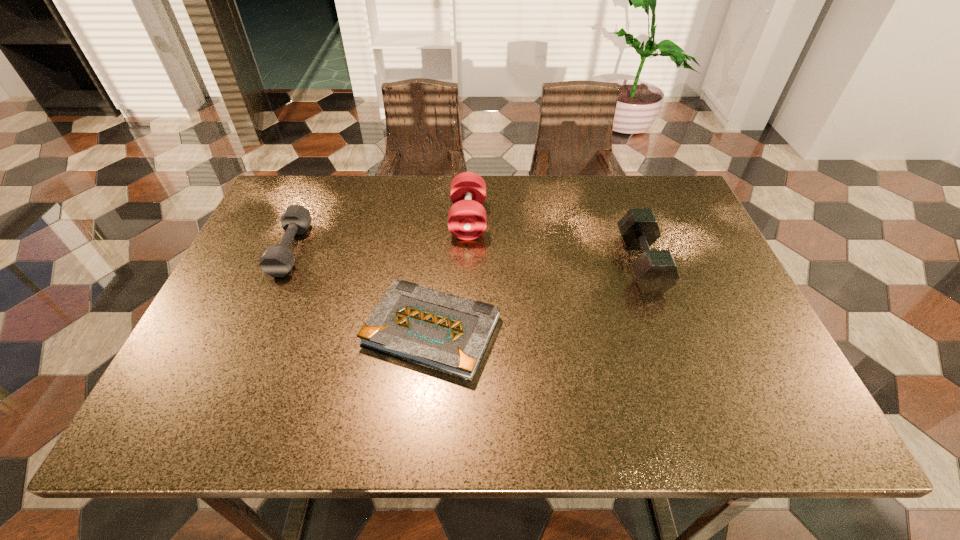
The height and width of the screenshot is (540, 960). I want to click on object located at the right edge, so click(x=656, y=272).

Locate an element on the screen. object at the far left corner is located at coordinates (277, 260).

Identify the location of vacant area at the far edge. This screenshot has height=540, width=960. pos(425,225).

Where is `vacant space at the near edge of the desktop`? The image size is (960, 540). vacant space at the near edge of the desktop is located at coordinates (372, 409).

In the image, there is a desktop. At what (x,y) coordinates should I click in order to perform the action: click on vacant space at the left edge. Please return your answer as a coordinate pair (x, y). This screenshot has height=540, width=960. Looking at the image, I should click on (221, 309).

Locate an element on the screen. The height and width of the screenshot is (540, 960). vacant space at the right edge of the desktop is located at coordinates (730, 288).

In the image, there is a desktop. Identify the location of free space at the far left corner. Image resolution: width=960 pixels, height=540 pixels. (283, 209).

You are a GUI agent. You are given a task and a screenshot of the screen. Output one action in this format:
    pyautogui.click(x=<x>, y=<y>)
    Task: Click on the vacant space at the near left corner of the desktop
    The height and width of the screenshot is (540, 960).
    Given the screenshot: What is the action you would take?
    pyautogui.click(x=183, y=427)

I want to click on vacant space at the far right corner, so click(x=683, y=206).

Image resolution: width=960 pixels, height=540 pixels. Identify the location of free spot at the near right corner of the desktop. (742, 395).